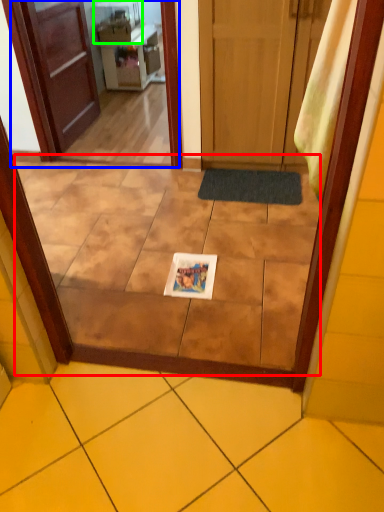
Question: Which object is positioned closest to ceramic tile (highlighted by a red box)? Select from screen door (highlighted by a blue box) and appliance (highlighted by a green box).

Choices:
 (A) screen door
 (B) appliance

Answer: (A)